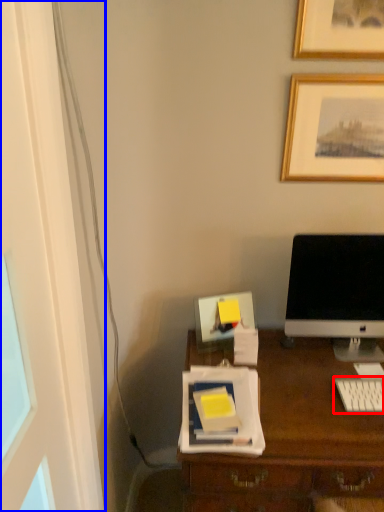
Question: Which object is closer to the camera taking this photo, computer keyboard (highlighted by a red box) or glass door (highlighted by a blue box)?

Choices:
 (A) computer keyboard
 (B) glass door

Answer: (B)